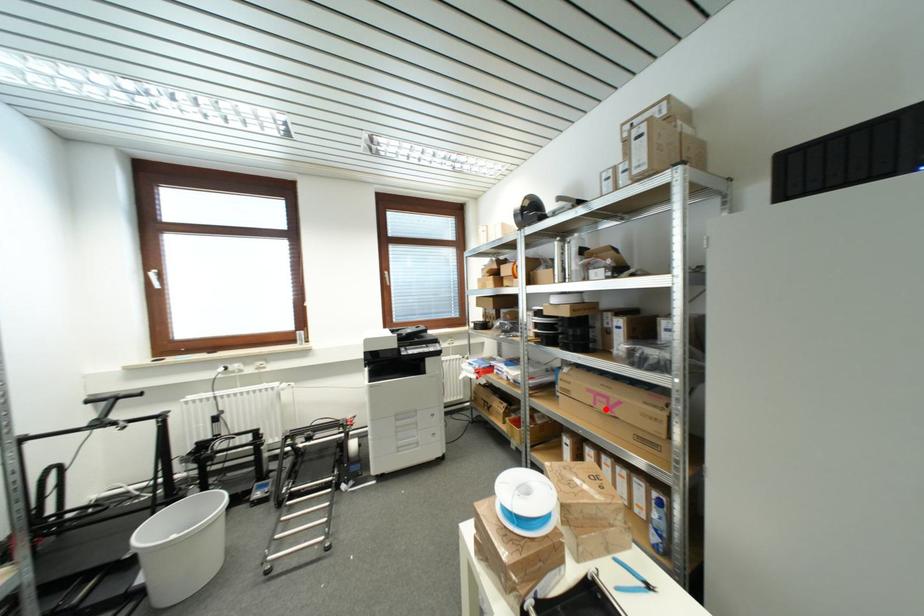
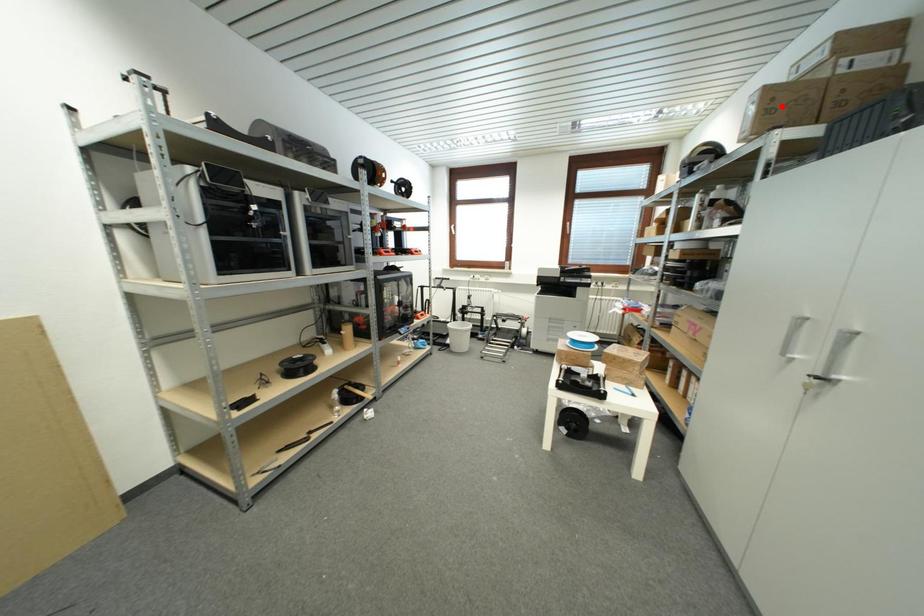
I am providing you with two images of the same scene from different viewpoints. A red point is marked on the first image and another point is marked on the second image. Is the marked point in image1 the same physical position as the marked point in image2?

No